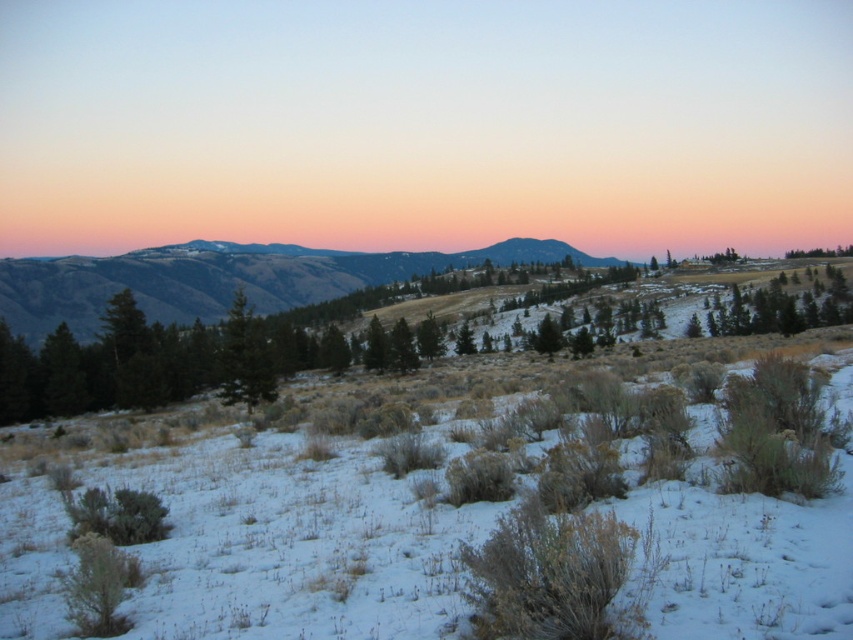
Looking at this image, based on the scene description, where is the green grassy hillside at center located in the image?

The green grassy hillside at center is located at point coordinates of (228, 278).

You are standing in the winter landscape and want to take a photo. You notice two points in the scene, point 1 at coordinates point (225, 292) and point 2 at coordinates point (763, 321). Which point is closer to your camera?

Point (225, 292) is further to the camera than point (763, 321). Therefore, point (763, 321) is closer to the camera.

You are standing at the point marked as point (228, 278) in the winter landscape image. What type of terrain are you currently standing on?

You are standing on a green grassy hillside at center, as indicated by the coordinates point (228, 278).